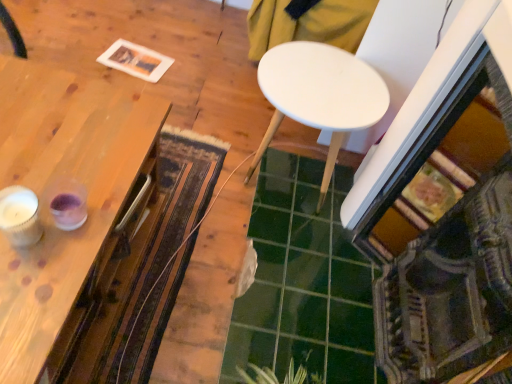
Find the location of a particular element. blank space situated above green glossy tile at center (from a real-world perspective) is located at coordinates coord(313,278).